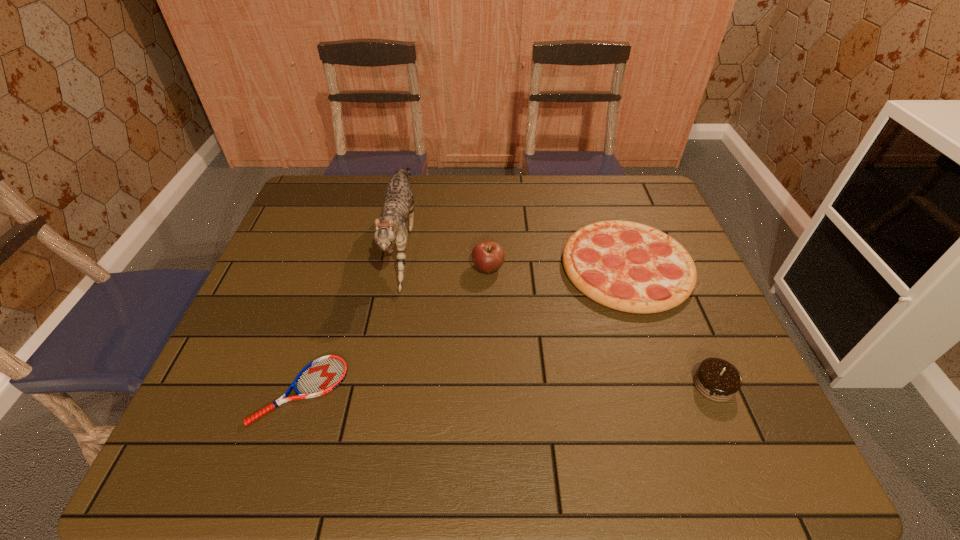
Identify the location of free space located 0.200m on the side of the third object from left to right with the unique marking. The width and height of the screenshot is (960, 540). coord(400,268).

Image resolution: width=960 pixels, height=540 pixels. What are the coordinates of `vacant space situated on the left of the chocolate cake` in the screenshot? It's located at (563, 385).

Where is `vacant region located 0.190m on the front of the second shortest object`? vacant region located 0.190m on the front of the second shortest object is located at coordinates (x=665, y=382).

Where is `vacant space situated 0.200m on the right of the tennis racket`? vacant space situated 0.200m on the right of the tennis racket is located at coordinates (435, 391).

Find the location of a particular element. The height and width of the screenshot is (540, 960). object situated at the far edge is located at coordinates (391, 227).

Where is `object that is at the left edge`? This screenshot has width=960, height=540. object that is at the left edge is located at coordinates click(321, 376).

Find the location of a particular element. The height and width of the screenshot is (540, 960). chocolate cake located in the right edge section of the desktop is located at coordinates (716, 379).

This screenshot has width=960, height=540. I want to click on pizza present at the right edge, so click(627, 266).

Identify the location of vacant space at the far edge of the desktop. (587, 180).

I want to click on vacant area at the near edge of the desktop, so click(x=621, y=470).